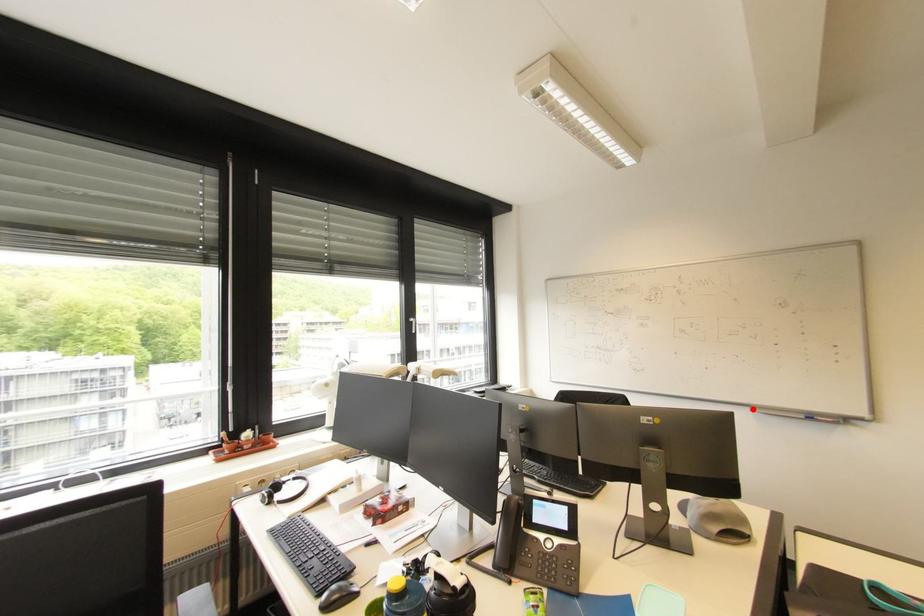
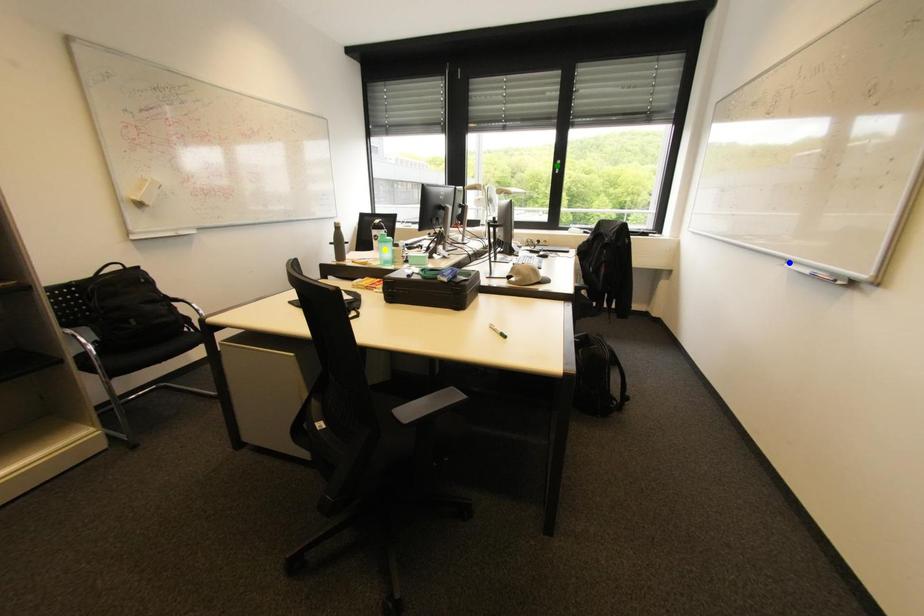
Question: I am providing you with two images of the same scene from different viewpoints. A red point is marked on the first image. You are given multiple points on the second image. Which mark in image 2 goes with the point in image 1?

Choices:
 (A) yellow point
 (B) green point
 (C) blue point

Answer: (C)